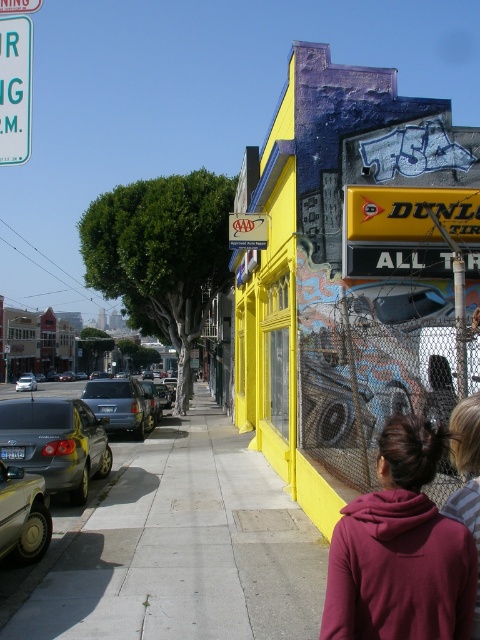
You are a delivery person standing at the camera position. You need to place a heavy box on the concrete sidewalk at center. Can you reach it without moving from your current position?

The concrete sidewalk at center is 14.85 feet away from your current position. Since this distance is too far for a person to reach manually, you would need to move closer to place the box there.

You are a pedestrian standing on the concrete sidewalk at center. You want to place a small potted plant between yourself and the yellow plastic sign at center. Is this possible?

The concrete sidewalk at center is closer to the viewer than the yellow plastic sign at center, so placing the potted plant between them is possible as the sidewalk is in front of the sign.

You are a delivery person standing on the sidewalk in front of the yellow building. You need to deliver a package to someone wearing a maroon hoodie at center and another to a shiny silver car at left. Which recipient is wider?

The maroon hoodie at center is wider than the shiny silver car at left.